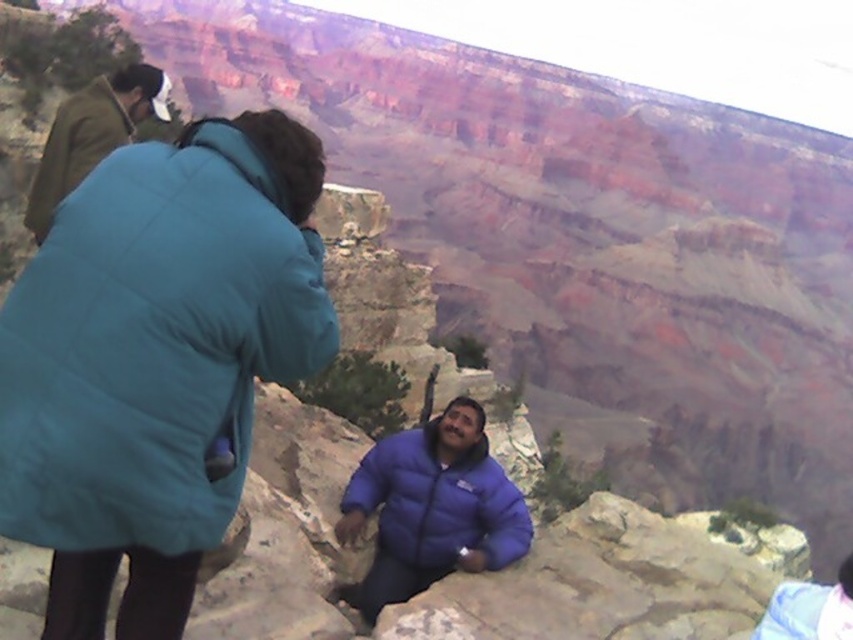
You are a photographer at the Grand Canyon. You notice two jackets in the scene. The teal quilted jacket at upper left and the brown woolen jacket at upper left. Which jacket would be easier to spot from a distance due to its size?

The teal quilted jacket at upper left is larger in size than the brown woolen jacket at upper left, so it would be easier to spot from a distance.

You are standing at the point marked by coordinates point (432, 508). Looking around, you see a teal jacket on the left and a blue puffy jacket at center. Which direction should you walk to reach the person in the teal jacket?

The teal jacket is on the left side of the frame, so you should walk to your left to reach the person in the teal jacket.